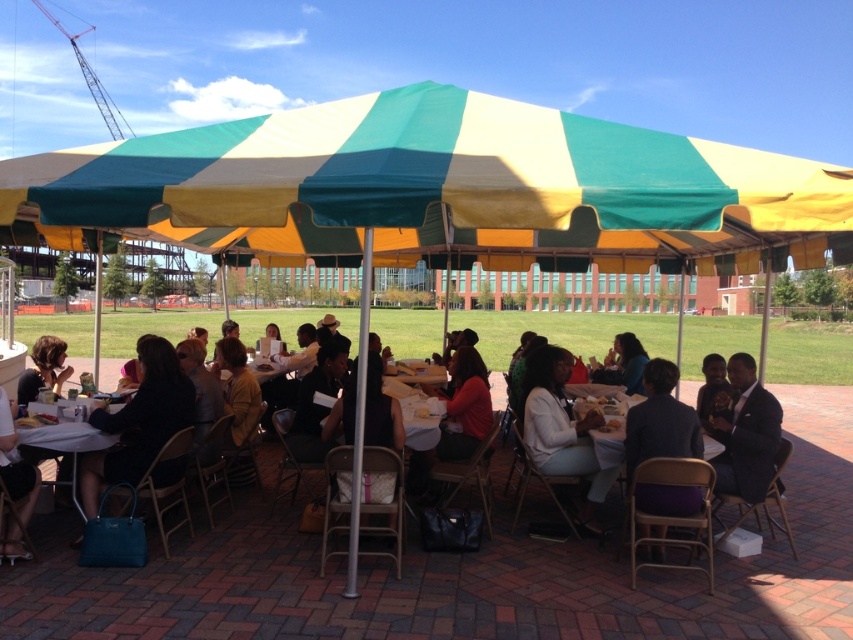
Does dark gray suit at lower right have a larger size compared to smooth black suit at lower right?

Incorrect, dark gray suit at lower right is not larger than smooth black suit at lower right.

Where is `dark gray suit at lower right`? This screenshot has width=853, height=640. dark gray suit at lower right is located at coordinates (660, 420).

Measure the distance between point (688, 449) and camera.

4.70 meters

Where is `dark gray suit at lower right`? The image size is (853, 640). dark gray suit at lower right is located at coordinates 660,420.

Who is more forward, (33, 474) or (26, 369)?

Point (33, 474)

Is matte black bag at lower left bigger than matte black hair at lower left?

Incorrect, matte black bag at lower left is not larger than matte black hair at lower left.

The image size is (853, 640). What do you see at coordinates (15, 484) in the screenshot? I see `matte black bag at lower left` at bounding box center [15, 484].

At what (x,y) coordinates should I click in order to perform the action: click on matte black bag at lower left. Please return your answer as a coordinate pair (x, y). This screenshot has height=640, width=853. Looking at the image, I should click on (15, 484).

Between point (746, 385) and point (627, 333), which one is positioned behind?

Positioned behind is point (627, 333).

Does dark blue suit at lower right appear on the right side of matte black jacket at center?

Indeed, dark blue suit at lower right is positioned on the right side of matte black jacket at center.

In order to click on dark blue suit at lower right in this screenshot , I will do `click(746, 435)`.